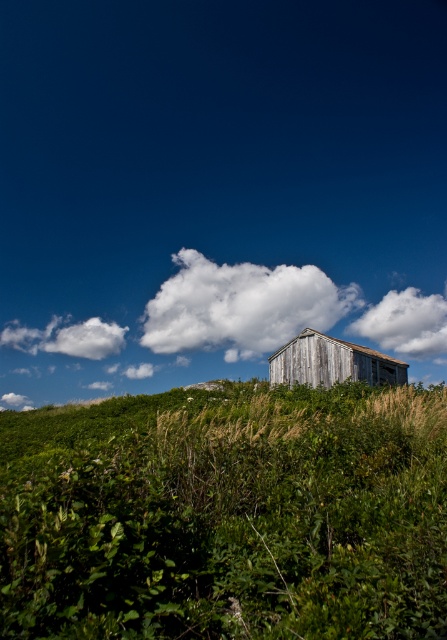
Question: Is white fluffy cloud at center thinner than weathered wood hut at center?

Choices:
 (A) yes
 (B) no

Answer: (B)

Question: Which object is farther from the camera taking this photo?

Choices:
 (A) white fluffy cloud at upper center
 (B) weathered wood hut at center
 (C) white fluffy cloud at upper left

Answer: (A)

Question: Which object is the closest to the white fluffy cloud at center?

Choices:
 (A) white fluffy cloud at upper center
 (B) weathered wood hut at center
 (C) white fluffy cloud at upper left

Answer: (C)

Question: Based on their relative distances, which object is farther from the weathered wood hut at center?

Choices:
 (A) white fluffy cloud at upper left
 (B) white fluffy cloud at upper center
 (C) white fluffy cloud at center
 (D) green leafy grass at center

Answer: (A)

Question: Does green leafy grass at center appear on the right side of white fluffy cloud at upper left?

Choices:
 (A) yes
 (B) no

Answer: (A)

Question: Is white fluffy cloud at center to the left of white fluffy cloud at upper center from the viewer's perspective?

Choices:
 (A) no
 (B) yes

Answer: (B)